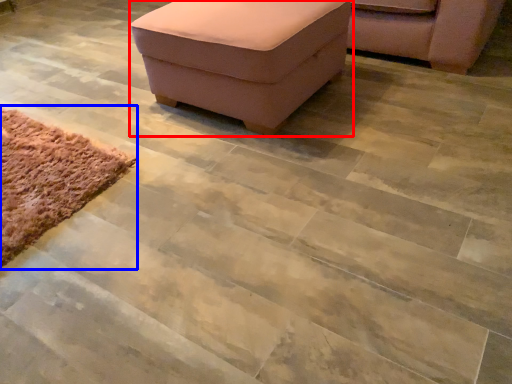
Question: Among these objects, which one is farthest to the camera, furniture (highlighted by a red box) or mat (highlighted by a blue box)?

Choices:
 (A) furniture
 (B) mat

Answer: (A)